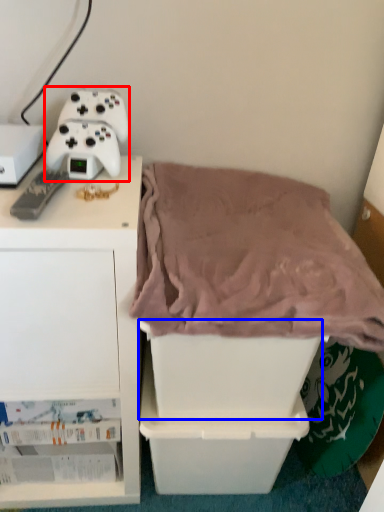
Question: Among these objects, which one is farthest to the camera, game controller (highlighted by a red box) or storage box (highlighted by a blue box)?

Choices:
 (A) game controller
 (B) storage box

Answer: (A)